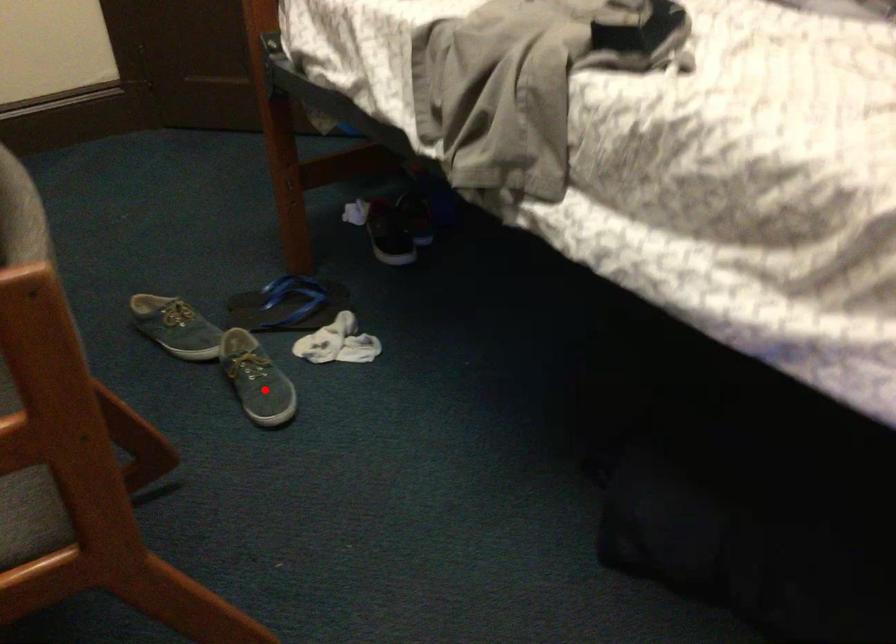
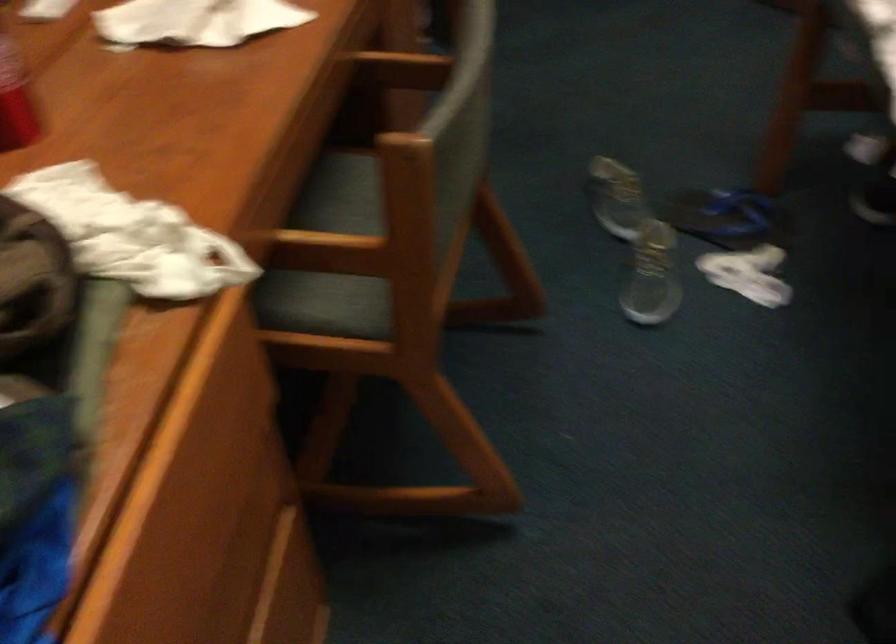
The point at the highlighted location is marked in the first image. Where is the corresponding point in the second image?

(650, 287)